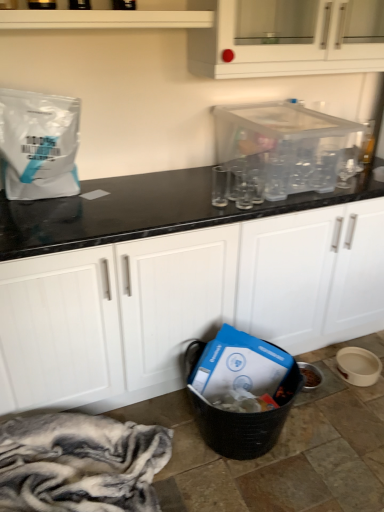
Question: Is white matte cabinet at center, the 1th cabinetry when ordered from bottom to top, spatially inside white glossy cabinet at upper center, which ranks as the second cabinetry in bottom-to-top order, or outside of it?

Choices:
 (A) inside
 (B) outside

Answer: (B)

Question: Based on their sizes in the image, would you say white matte cabinet at center, the 1th cabinetry when ordered from bottom to top, is bigger or smaller than white glossy cabinet at upper center, which ranks as the second cabinetry in bottom-to-top order?

Choices:
 (A) big
 (B) small

Answer: (A)

Question: Which object is the closest to the white matte paper bag at upper left?

Choices:
 (A) white glossy shelf at upper center
 (B) white matte cabinet at center, the 1th cabinetry when ordered from bottom to top
 (C) transparent plastic container at upper center
 (D) white glossy cabinet at upper center, which ranks as the second cabinetry in bottom-to-top order

Answer: (A)

Question: Which is nearer to the white matte paper bag at upper left?

Choices:
 (A) white glossy cabinet at upper center, which ranks as the second cabinetry in bottom-to-top order
 (B) transparent plastic container at upper center
 (C) white glossy shelf at upper center
 (D) white matte cabinet at center, which is the 2th cabinetry in top-to-bottom order

Answer: (C)